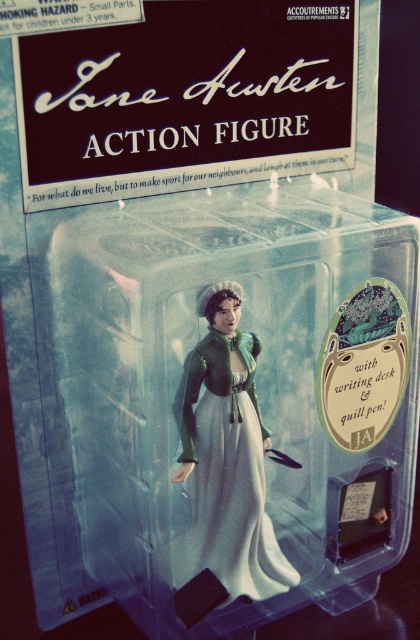
How much distance is there between transparent plastic action figure at center and matte green fabric dress at center?

The distance of transparent plastic action figure at center from matte green fabric dress at center is 8.37 centimeters.

Who is taller, transparent plastic action figure at center or matte green fabric dress at center?

transparent plastic action figure at center is taller.

Which is behind, point (320, 406) or point (189, 541)?

The point (320, 406) is behind.

You are a GUI agent. You are given a task and a screenshot of the screen. Output one action in this format:
    pyautogui.click(x=<x>, y=<y>)
    Task: Click on the transparent plastic action figure at center
    
    Given the screenshot: What is the action you would take?
    pyautogui.click(x=238, y=397)